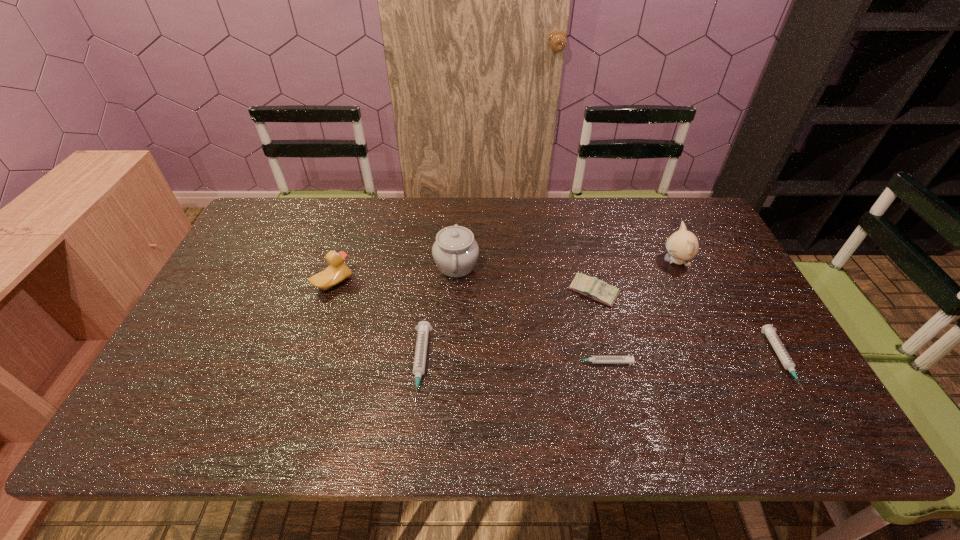
Image resolution: width=960 pixels, height=540 pixels. I want to click on syringe at the right edge, so click(768, 330).

Where is `kitten that is at the right edge`? kitten that is at the right edge is located at coordinates (683, 245).

Locate an element on the screen. This screenshot has height=540, width=960. object situated at the near right corner is located at coordinates (768, 330).

The image size is (960, 540). I want to click on blank space at the far edge of the desktop, so click(x=637, y=198).

Find the location of a particular element. This screenshot has height=540, width=960. vacant space at the near edge of the desktop is located at coordinates (324, 376).

In the image, there is a desktop. Identify the location of vacant space at the left edge. The height and width of the screenshot is (540, 960). (235, 278).

Where is `vacant space at the far left corner`? Image resolution: width=960 pixels, height=540 pixels. vacant space at the far left corner is located at coordinates (291, 222).

Find the location of `blank region between the shortest object and the sixth object from left to right`. blank region between the shortest object and the sixth object from left to right is located at coordinates (638, 312).

Where is `free point between the chinaware and the second syringe from right to left`? The width and height of the screenshot is (960, 540). free point between the chinaware and the second syringe from right to left is located at coordinates (529, 314).

Locate an element on the screen. free spot between the kitten and the diary is located at coordinates (635, 276).